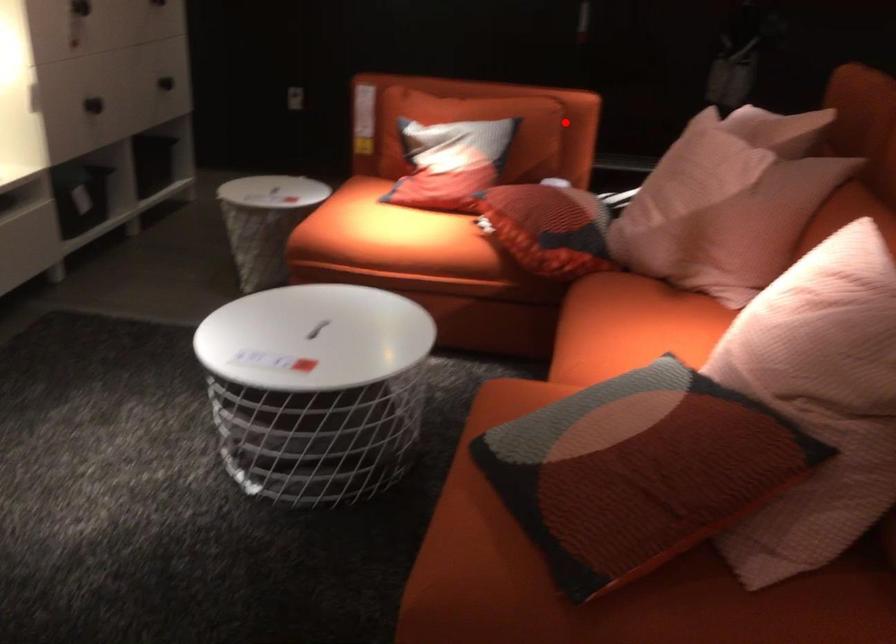
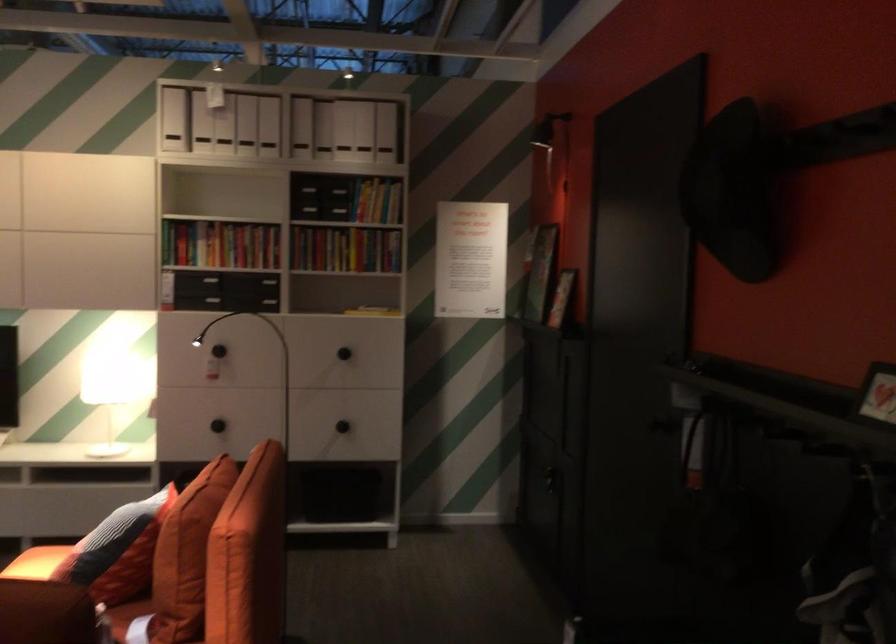
The point at the highlighted location is marked in the first image. Where is the corresponding point in the second image?

(186, 554)